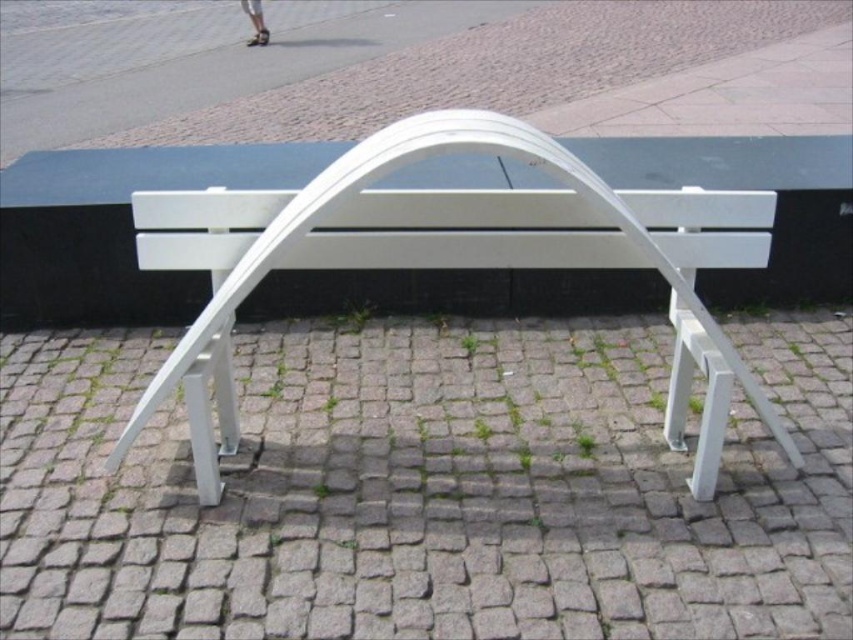
Which of these two, gray cobblestone pavement at center or white matte bench at center, stands shorter?

With less height is gray cobblestone pavement at center.

Where is `gray cobblestone pavement at center`? gray cobblestone pavement at center is located at coordinates (425, 488).

Is point (840, 422) positioned before point (572, 214)?

No, it is behind (572, 214).

At what (x,y) coordinates should I click in order to perform the action: click on gray cobblestone pavement at center. Please return your answer as a coordinate pair (x, y). Image resolution: width=853 pixels, height=640 pixels. Looking at the image, I should click on (425, 488).